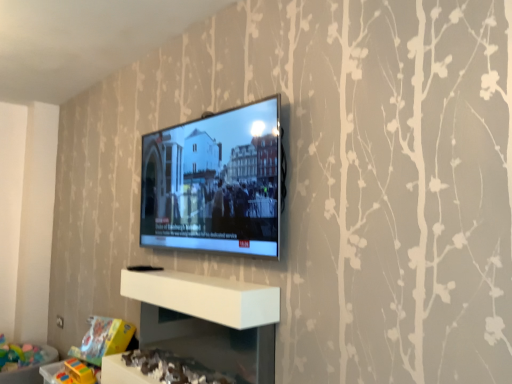
Question: Is matte black tv at center surrounded by white glossy shelf at lower center, placed as the 1th shelf when sorted from bottom to top?

Choices:
 (A) no
 (B) yes

Answer: (A)

Question: Is white glossy shelf at lower center, the second shelf positioned from the top, not within matte black tv at center?

Choices:
 (A) yes
 (B) no

Answer: (A)

Question: Can you confirm if white glossy shelf at lower center, the second shelf positioned from the top, is shorter than matte black tv at center?

Choices:
 (A) no
 (B) yes

Answer: (B)

Question: Does white glossy shelf at lower center, the second shelf positioned from the top, lie behind matte black tv at center?

Choices:
 (A) yes
 (B) no

Answer: (B)

Question: From the image's perspective, does white glossy shelf at lower center, the second shelf positioned from the top, appear lower than matte black tv at center?

Choices:
 (A) no
 (B) yes

Answer: (B)

Question: Is white glossy shelf at lower center, the second shelf positioned from the top, smaller than matte black tv at center?

Choices:
 (A) no
 (B) yes

Answer: (A)

Question: Is white matte shelf at center, the 1th shelf from the top, bigger than matte black tv at center?

Choices:
 (A) yes
 (B) no

Answer: (B)

Question: Is white matte shelf at center, which is the second shelf from bottom to top, closer to camera compared to matte black tv at center?

Choices:
 (A) yes
 (B) no

Answer: (A)

Question: Does white matte shelf at center, which is the second shelf from bottom to top, appear on the right side of matte black tv at center?

Choices:
 (A) no
 (B) yes

Answer: (A)

Question: Does white matte shelf at center, the 1th shelf from the top, appear on the left side of matte black tv at center?

Choices:
 (A) no
 (B) yes

Answer: (B)

Question: Does white matte shelf at center, which is the second shelf from bottom to top, have a lesser height compared to matte black tv at center?

Choices:
 (A) no
 (B) yes

Answer: (B)

Question: Can you confirm if white matte shelf at center, the 1th shelf from the top, is wider than matte black tv at center?

Choices:
 (A) no
 (B) yes

Answer: (B)

Question: Are white glossy shelf at lower center, placed as the 1th shelf when sorted from bottom to top, and white matte shelf at center, which is the second shelf from bottom to top, located far from each other?

Choices:
 (A) yes
 (B) no

Answer: (B)